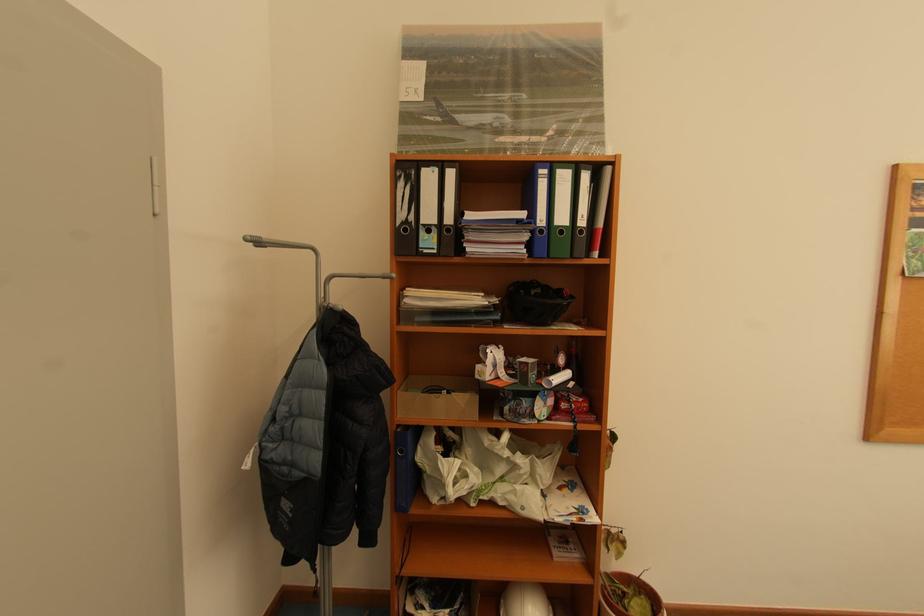
Describe the element at coordinates (561, 209) in the screenshot. I see `the green binder finger hole` at that location.